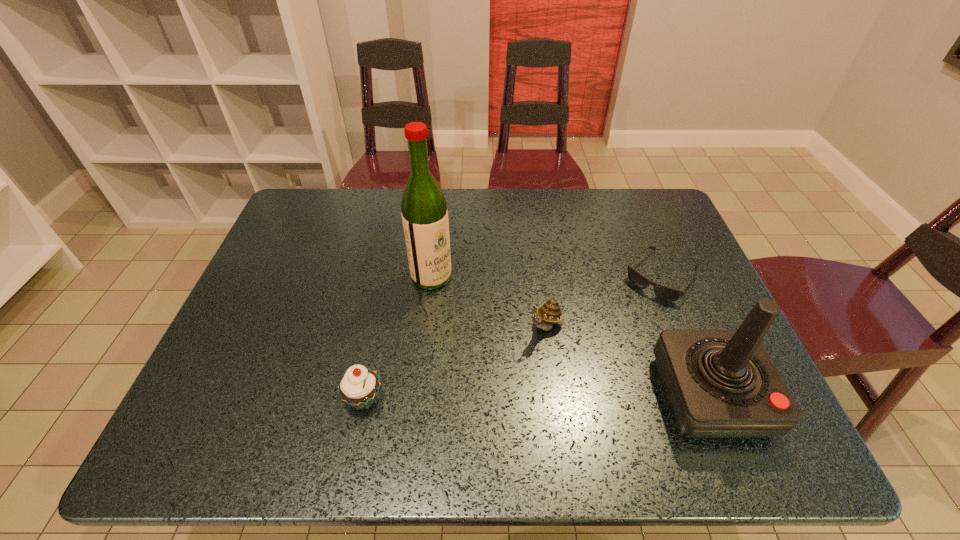
This screenshot has height=540, width=960. In order to click on blank space located 0.140m on the face of the third object from left to right in this screenshot , I will do `click(505, 384)`.

The width and height of the screenshot is (960, 540). I want to click on free space located on the front-facing side of the shortest object, so click(x=592, y=368).

Where is `blank space located 0.380m on the front-facing side of the shortest object`? Image resolution: width=960 pixels, height=540 pixels. blank space located 0.380m on the front-facing side of the shortest object is located at coordinates (570, 398).

In order to click on free location located 0.070m on the front-facing side of the shortest object in this screenshot , I will do pos(634,314).

Find the location of a particular element. This screenshot has height=540, width=960. vacant space situated on the label of the tallest object is located at coordinates (553, 369).

I want to click on free space located on the label of the tallest object, so click(x=540, y=359).

This screenshot has width=960, height=540. What are the coordinates of `blank space located on the label of the tallest object` in the screenshot? It's located at (517, 342).

At what (x,y) coordinates should I click in order to perform the action: click on cupcake present at the near edge. Please return your answer as a coordinate pair (x, y). The width and height of the screenshot is (960, 540). Looking at the image, I should click on (359, 387).

You are a GUI agent. You are given a task and a screenshot of the screen. Output one action in this format:
    pyautogui.click(x=<x>, y=<y>)
    Task: Click on the joystick that is at the near edge
    This screenshot has width=960, height=540.
    Given the screenshot: What is the action you would take?
    pyautogui.click(x=719, y=383)

I want to click on joystick that is at the right edge, so click(x=719, y=383).